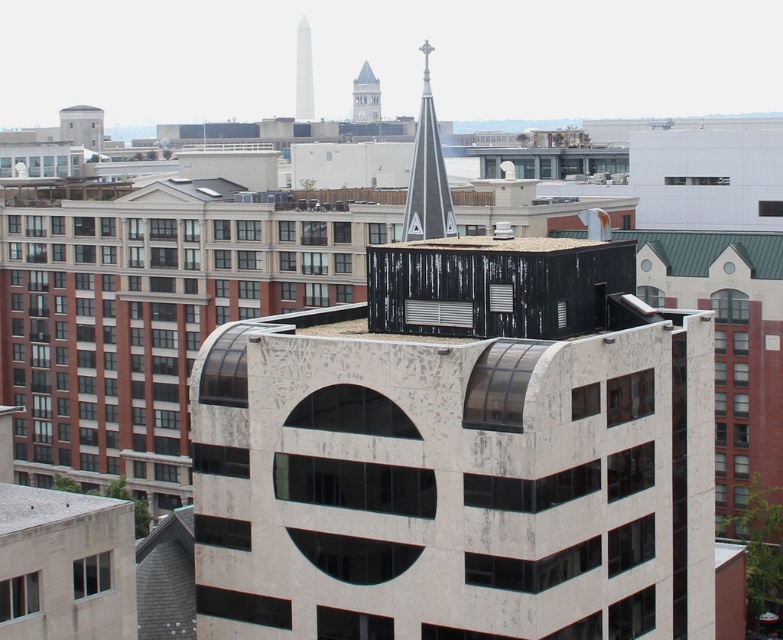
You are an architect analyzing the cityscape. You notice a point at coordinates (x=709, y=250). What is the object located at this point?

The point at coordinates (x=709, y=250) corresponds to the green corrugated metal roof at upper right.

You are an architect analyzing the cityscape. You notice the green corrugated metal roof at upper right and the white marble tower at upper center. Which of these two structures is shorter in height?

The green corrugated metal roof at upper right is not as tall as the white marble tower at upper center, so the green corrugated metal roof at upper right is shorter in height.